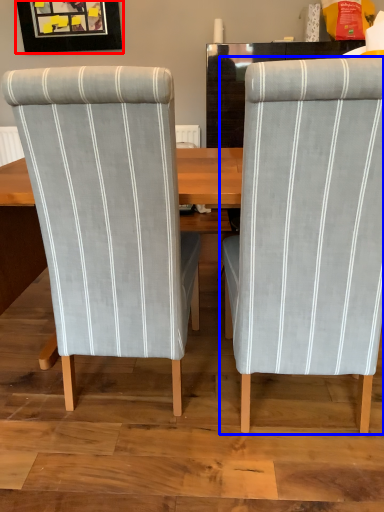
Question: Among these objects, which one is farthest to the camera, picture frame (highlighted by a red box) or chair (highlighted by a blue box)?

Choices:
 (A) picture frame
 (B) chair

Answer: (A)